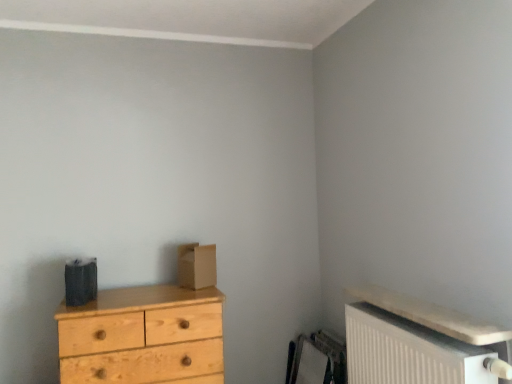
Question: Which is correct: white textured radiator at lower right is inside natural wood chest of drawers at left, or outside of it?

Choices:
 (A) outside
 (B) inside

Answer: (A)

Question: From their relative heights in the image, would you say white textured radiator at lower right is taller or shorter than natural wood chest of drawers at left?

Choices:
 (A) short
 (B) tall

Answer: (A)

Question: Which object is positioned closest to the brown cardboard box at center?

Choices:
 (A) natural wood chest of drawers at left
 (B) white textured radiator at lower right

Answer: (A)

Question: Considering the real-world distances, which object is closest to the white textured radiator at lower right?

Choices:
 (A) brown cardboard box at center
 (B) natural wood chest of drawers at left

Answer: (B)